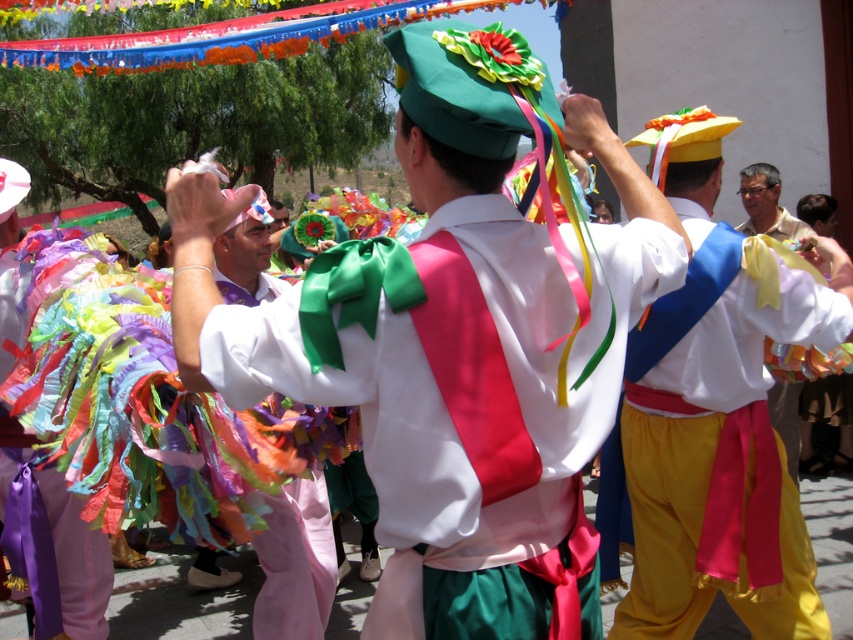
You are a photographer standing at the edge of the parade route. You want to capture a photo that includes both the multicolored fabric ribbons at center and the yellow satin pants at right. Given that your camera has a maximum focus range of 5 feet, will you be able to fit both subjects into the frame without moving closer?

The distance between the multicolored fabric ribbons at center and the yellow satin pants at right is 4.83 feet, which is within the camera maximum focus range of 5 feet. Therefore, you can fit both subjects into the frame without moving closer.

You are a photographer trying to capture the central figure in the parade. You notice the multicolored fabric ribbons at center and the yellow satin pants at right. Which object is shorter in height?

The multicolored fabric ribbons at center has a lesser height compared to the yellow satin pants at right, so the multicolored fabric ribbons at center is shorter in height.